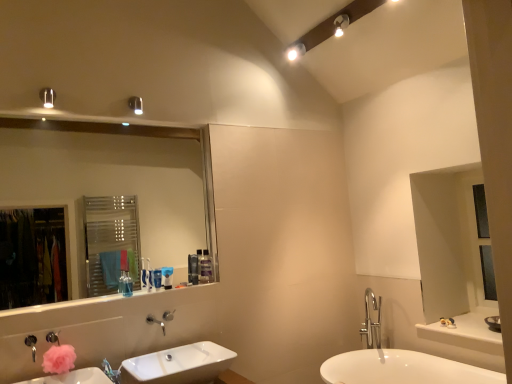
Question: From a real-world perspective, is satin black soap dispenser at upper center, acting as the 2th toiletry starting from the right, physically below blue plastic toothbrush at upper center, positioned as the third toiletry in front-to-back order?

Choices:
 (A) yes
 (B) no

Answer: (B)

Question: Does satin black soap dispenser at upper center, which appears as the fourth toiletry when viewed from the left, have a smaller size compared to blue plastic toothbrush at upper center, positioned as the third toiletry in front-to-back order?

Choices:
 (A) yes
 (B) no

Answer: (B)

Question: Does satin black soap dispenser at upper center, which appears as the fourth toiletry when viewed from the left, have a greater height compared to blue plastic toothbrush at upper center, the 3th toiletry positioned from the right?

Choices:
 (A) no
 (B) yes

Answer: (B)

Question: Is satin black soap dispenser at upper center, which is counted as the 4th toiletry, starting from the front, not near blue plastic toothbrush at upper center, the 3th toiletry positioned from the right?

Choices:
 (A) yes
 (B) no

Answer: (B)

Question: From a real-world perspective, is satin black soap dispenser at upper center, the second toiletry positioned from the back, on top of blue plastic toothbrush at upper center, the 3th toiletry positioned from the right?

Choices:
 (A) yes
 (B) no

Answer: (A)

Question: In the image, is blue plastic toothbrush at upper center, the third toiletry viewed from the left, positioned in front of or behind translucent plastic toothbrush at center, which is counted as the 5th toiletry, starting from the right?

Choices:
 (A) front
 (B) behind

Answer: (B)

Question: In terms of size, does blue plastic toothbrush at upper center, which ranks as the third toiletry in back-to-front order, appear bigger or smaller than translucent plastic toothbrush at center, which appears as the first toiletry when viewed from the front?

Choices:
 (A) big
 (B) small

Answer: (B)

Question: Is point (169, 284) closer or farther from the camera than point (150, 278)?

Choices:
 (A) closer
 (B) farther

Answer: (B)

Question: Visually, is blue plastic toothbrush at upper center, the third toiletry viewed from the left, positioned to the left or to the right of translucent plastic toothbrush at center, which appears as the first toiletry when viewed from the left?

Choices:
 (A) left
 (B) right

Answer: (B)

Question: From a real-world perspective, is translucent plastic toothbrush at center, which appears as the first toiletry when viewed from the front, physically located above or below matte white light fixture at upper center, which is the 1th light fixture from right to left?

Choices:
 (A) above
 (B) below

Answer: (B)

Question: In terms of width, does translucent plastic toothbrush at center, which appears as the first toiletry when viewed from the front, look wider or thinner when compared to matte white light fixture at upper center, the fourth light fixture positioned from the left?

Choices:
 (A) wide
 (B) thin

Answer: (B)

Question: Is point (x=146, y=276) positioned closer to the camera than point (x=337, y=34)?

Choices:
 (A) farther
 (B) closer

Answer: (B)

Question: From the image's perspective, is translucent plastic toothbrush at center, acting as the 5th toiletry starting from the back, above or below matte white light fixture at upper center, the fourth light fixture positioned from the left?

Choices:
 (A) above
 (B) below

Answer: (B)

Question: In terms of size, does white glossy spot light at upper center, the third light fixture in the left-to-right sequence, appear bigger or smaller than translucent plastic toothbrush at center, which appears as the first toiletry when viewed from the left?

Choices:
 (A) small
 (B) big

Answer: (B)

Question: Is white glossy spot light at upper center, the 2th light fixture in the right-to-left sequence, taller or shorter than translucent plastic toothbrush at center, which appears as the first toiletry when viewed from the left?

Choices:
 (A) short
 (B) tall

Answer: (A)